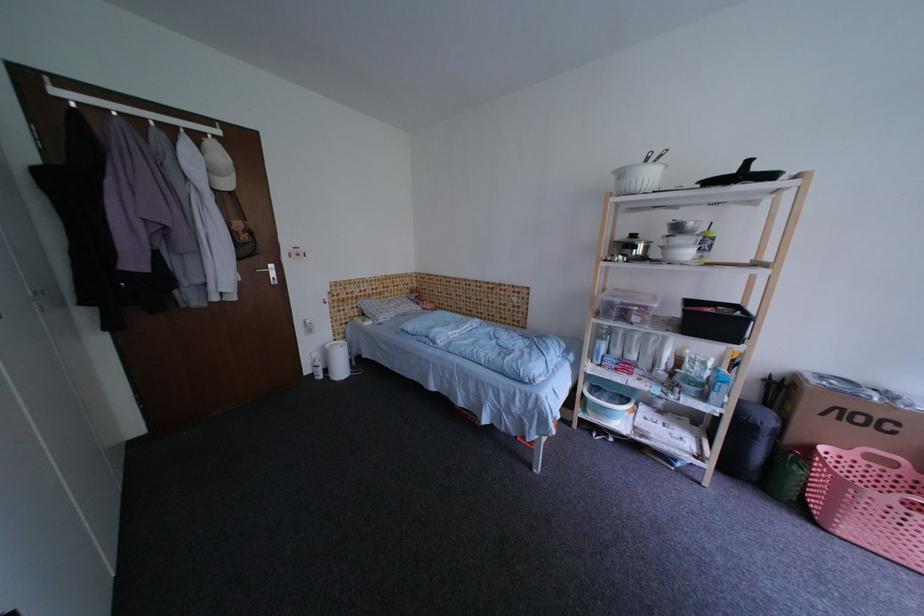
Find where to lift the pan lid handle. Please return your answer as a coordinate pair (x, y).

(633, 238)